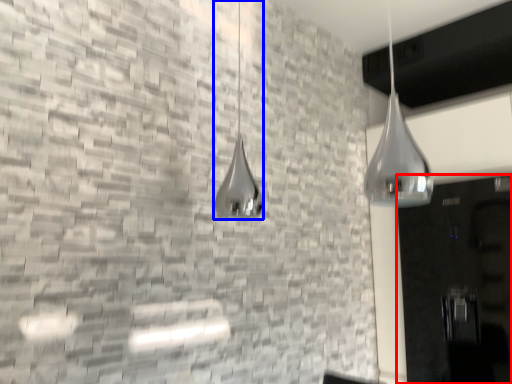
Question: Among these objects, which one is farthest to the camera, door (highlighted by a red box) or shower (highlighted by a blue box)?

Choices:
 (A) door
 (B) shower

Answer: (A)